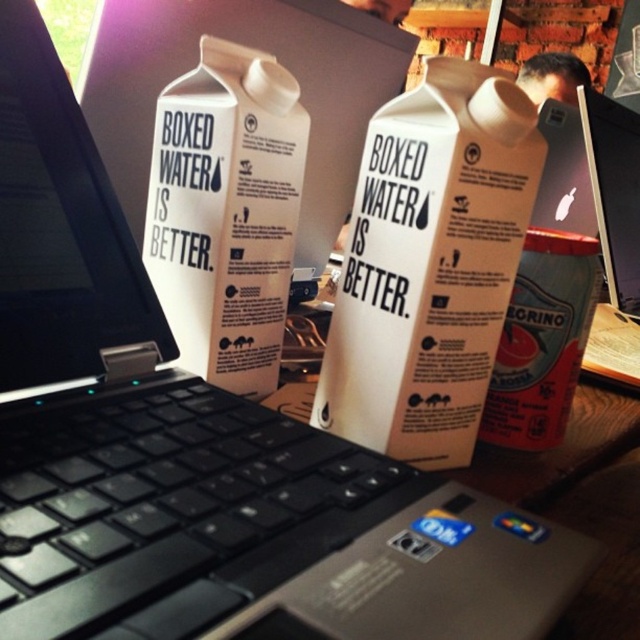
You are setting up your desk and need to place the black plastic keyboard at center and the white matte carton at center. According to the image, which object is closer to you when both are placed on the desk?

The black plastic keyboard at center is closer to you because it is in front of the white matte carton at center.

You are organizing a small event and need to arrange the items from nearest to farthest from the attendees. The attendees are sitting in front of the workspace. Which order should you place the white matte carton at center and the metallic silver can at right?

The white matte carton at center should be placed first as it is closer to the attendees, followed by the metallic silver can at right since it is farther away.

You are organizing your desk and want to place the black plastic keyboard at center and the white matte carton at center side by side. Based on their widths, which one should be placed on the left to ensure they fit within the desk space?

The black plastic keyboard at center is wider than the white matte carton at center. To fit them side by side on the desk, the wider object should be placed on the left to accommodate its size, so the black plastic keyboard at center should be positioned on the left.